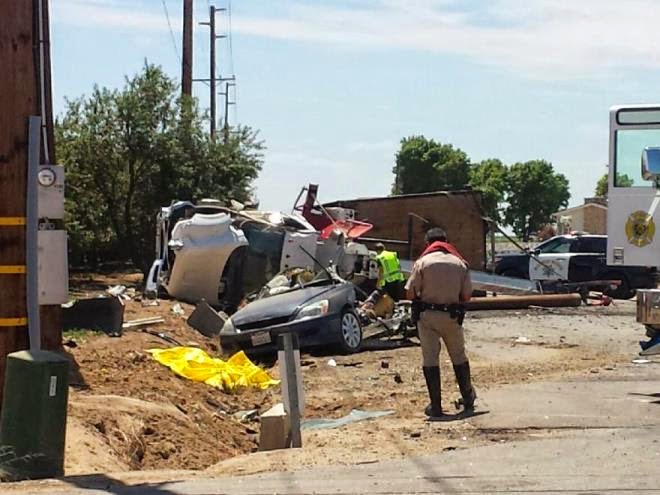
This screenshot has width=660, height=495. In order to click on door in this screenshot , I will do `click(627, 211)`.